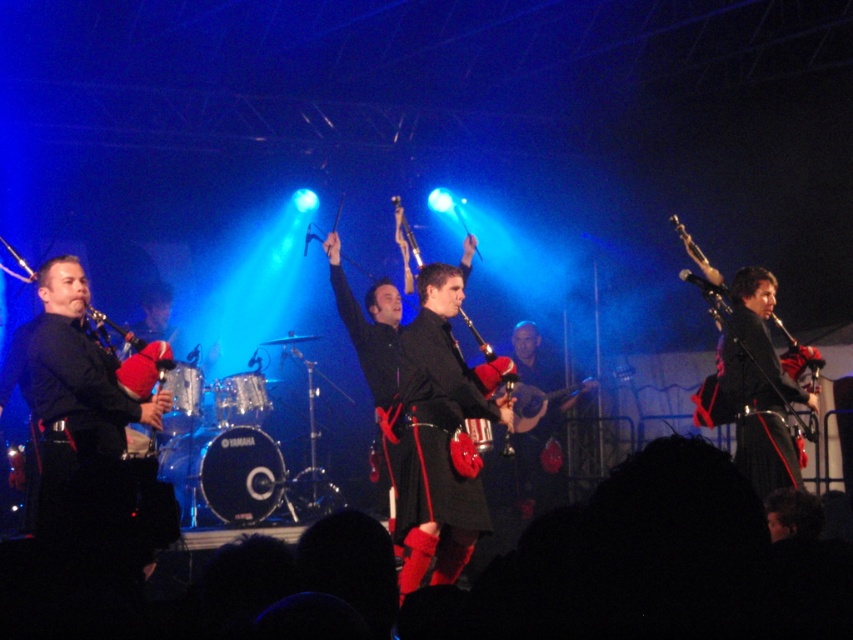
Locate an element on the screen. black leather kilt at center is located at coordinates (438, 435).

Which is behind, point (463, 380) or point (689, 248)?

Positioned behind is point (689, 248).

Find the location of a particular element. black leather kilt at center is located at coordinates (438, 435).

Describe the element at coordinates (695, 253) in the screenshot. Image resolution: width=853 pixels, height=640 pixels. I see `matte black bagpipes at right` at that location.

Is point (695, 260) more distant than point (524, 410)?

No, it is not.

Is point (801, 422) closer to camera compared to point (531, 392)?

Yes, point (801, 422) is closer to viewer.

This screenshot has height=640, width=853. In order to click on matte black bagpipes at right in this screenshot , I will do `click(695, 253)`.

What do you see at coordinates (438, 435) in the screenshot?
I see `black leather kilt at center` at bounding box center [438, 435].

From the picture: Is black leather kilt at center smaller than matte black bagpipes at center?

No, black leather kilt at center is not smaller than matte black bagpipes at center.

Where is `black leather kilt at center`? black leather kilt at center is located at coordinates (438, 435).

Find the location of a particular element. The image size is (853, 640). black leather kilt at center is located at coordinates (438, 435).